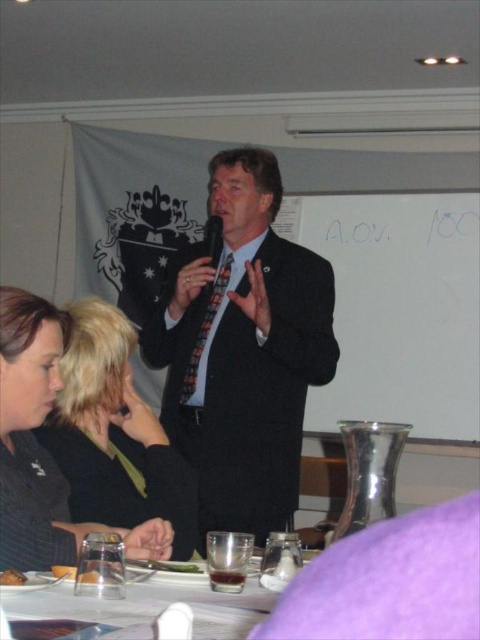
In the scene shown: What is located at the coordinates point (115, 435) in the image?

The point (115, 435) corresponds to black fabric hair at center.

You are a photographer standing behind the speaker. You need to take a closeup shot of the matte black suit at center and the multicolored patterned tie at center. How far apart are these two items in inches?

The matte black suit at center is 7.15 inches away from the multicolored patterned tie at center.

You are a server at a banquet and need to determine if the clear glass at lower center can fit under the multicolored patterned tie at center without the tie getting wet. Based on their heights, can the glass be placed there safely?

The clear glass at lower center is not as tall as the multicolored patterned tie at center, so placing the glass there would not risk the tie getting wet since the glass is shorter.